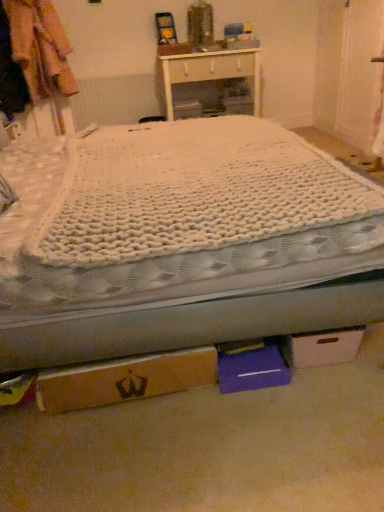
Question: From the image's perspective, is brown cardboard box at lower center, the first cardboard box viewed from the left, on white knitted blanket at center?

Choices:
 (A) yes
 (B) no

Answer: (B)

Question: Considering the relative sizes of brown cardboard box at lower center, the first cardboard box viewed from the left, and white knitted blanket at center in the image provided, is brown cardboard box at lower center, the first cardboard box viewed from the left, smaller than white knitted blanket at center?

Choices:
 (A) yes
 (B) no

Answer: (A)

Question: Does brown cardboard box at lower center, the second cardboard box positioned from the right, lie behind white knitted blanket at center?

Choices:
 (A) no
 (B) yes

Answer: (B)

Question: Is brown cardboard box at lower center, the first cardboard box viewed from the left, outside of white knitted blanket at center?

Choices:
 (A) yes
 (B) no

Answer: (A)

Question: From a real-world perspective, is brown cardboard box at lower center, the second cardboard box positioned from the right, beneath white knitted blanket at center?

Choices:
 (A) no
 (B) yes

Answer: (A)

Question: Considering their positions, is cardboard box at lower right, positioned as the second cardboard box in left-to-right order, located in front of or behind brown cardboard box at lower center, the first cardboard box viewed from the left?

Choices:
 (A) behind
 (B) front

Answer: (A)

Question: Is cardboard box at lower right, positioned as the second cardboard box in left-to-right order, situated inside brown cardboard box at lower center, the first cardboard box viewed from the left, or outside?

Choices:
 (A) inside
 (B) outside

Answer: (B)

Question: Based on their positions, is cardboard box at lower right, positioned as the second cardboard box in left-to-right order, located to the left or right of brown cardboard box at lower center, the second cardboard box positioned from the right?

Choices:
 (A) right
 (B) left

Answer: (A)

Question: Considering the positions of cardboard box at lower right, positioned as the second cardboard box in left-to-right order, and brown cardboard box at lower center, the second cardboard box positioned from the right, in the image, is cardboard box at lower right, positioned as the second cardboard box in left-to-right order, wider or thinner than brown cardboard box at lower center, the second cardboard box positioned from the right,?

Choices:
 (A) thin
 (B) wide

Answer: (B)

Question: From a real-world perspective, is purple cardboard box at lower center, the 2th storage box viewed from the back, above or below white cardboard box at center, the 2th storage box when ordered from front to back?

Choices:
 (A) below
 (B) above

Answer: (A)

Question: Is purple cardboard box at lower center, the 2th storage box viewed from the back, bigger or smaller than white cardboard box at center, placed as the first storage box when sorted from back to front?

Choices:
 (A) big
 (B) small

Answer: (B)

Question: Is purple cardboard box at lower center, the 2th storage box positioned from the top, inside or outside of white cardboard box at center, the second storage box positioned from the right?

Choices:
 (A) outside
 (B) inside

Answer: (A)

Question: Is point click(x=256, y=385) closer or farther from the camera than point click(x=175, y=102)?

Choices:
 (A) farther
 (B) closer

Answer: (B)

Question: Relative to white knitted blanket at center, is brown cardboard box at lower center, the second cardboard box positioned from the right, in front or behind?

Choices:
 (A) front
 (B) behind

Answer: (B)

Question: Is brown cardboard box at lower center, the first cardboard box viewed from the left, spatially inside white knitted blanket at center, or outside of it?

Choices:
 (A) outside
 (B) inside

Answer: (A)